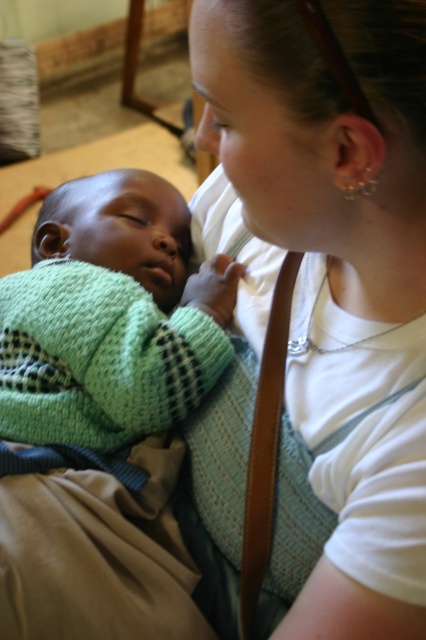
Which is more to the left, knitted green sweater at center-left or brown leather strap at center?

From the viewer's perspective, knitted green sweater at center-left appears more on the left side.

Locate an element on the screen. The image size is (426, 640). knitted green sweater at center-left is located at coordinates (111, 316).

Is point (397, 83) positioned in front of point (118, 419)?

Yes.

Which is behind, point (377, 92) or point (123, 278)?

Point (123, 278)

Which is behind, point (308, 401) or point (69, 300)?

Positioned behind is point (69, 300).

You are a GUI agent. You are given a task and a screenshot of the screen. Output one action in this format:
    pyautogui.click(x=<x>, y=<y>)
    Task: Click on the white fabric at upper right
    
    Given the screenshot: What is the action you would take?
    pyautogui.click(x=319, y=193)

Does white fabric at upper right appear under brown leather strap at center?

Incorrect, white fabric at upper right is not positioned below brown leather strap at center.

Who is shorter, white fabric at upper right or brown leather strap at center?

With less height is brown leather strap at center.

Between point (264, 129) and point (256, 509), which one is positioned in front?

Point (264, 129) is more forward.

The height and width of the screenshot is (640, 426). Find the location of `white fabric at upper right`. white fabric at upper right is located at coordinates (319, 193).